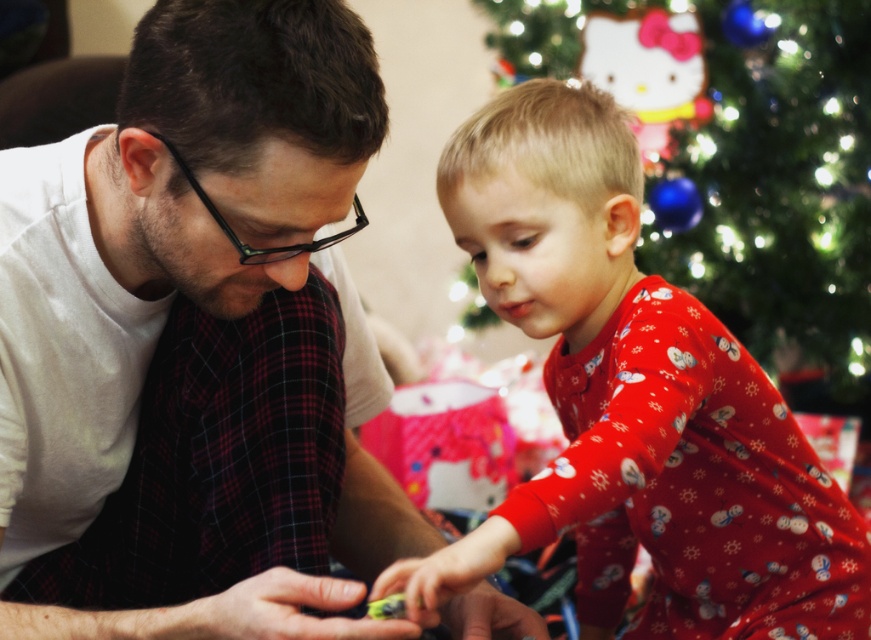
You are standing in front of the Christmas tree and want to place a small gift exactly at the point marked as point (664,616). If you need to reach a point that is 4 feet away from you, will you be able to place the gift at that exact point?

The distance of point (664,616) from viewer is 4.17 feet, so you are 0.17 feet too far to place the gift at that exact point.

You are a photographer trying to capture a photo of the two people in the scene. Since you want to ensure both the white matte shirt at center and the red cotton pajamas at center are clearly visible in the frame, which one should you adjust the camera focus on first to ensure proper alignment?

The white matte shirt at center is positioned on the left side of red cotton pajamas at center, so you should focus on the white matte shirt at center first to ensure proper alignment since it is closer to the left edge of the frame.